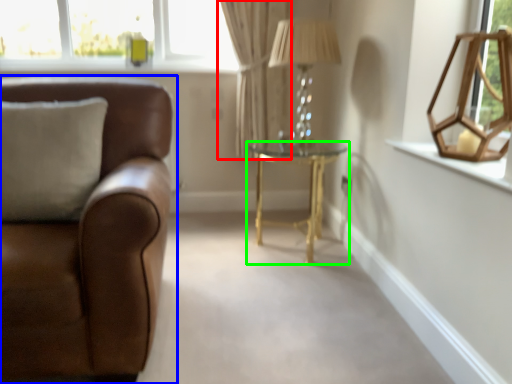
Question: Which object is positioned farthest from curtain (highlighted by a red box)? Select from studio couch (highlighted by a blue box) and table (highlighted by a green box).

Choices:
 (A) studio couch
 (B) table

Answer: (A)